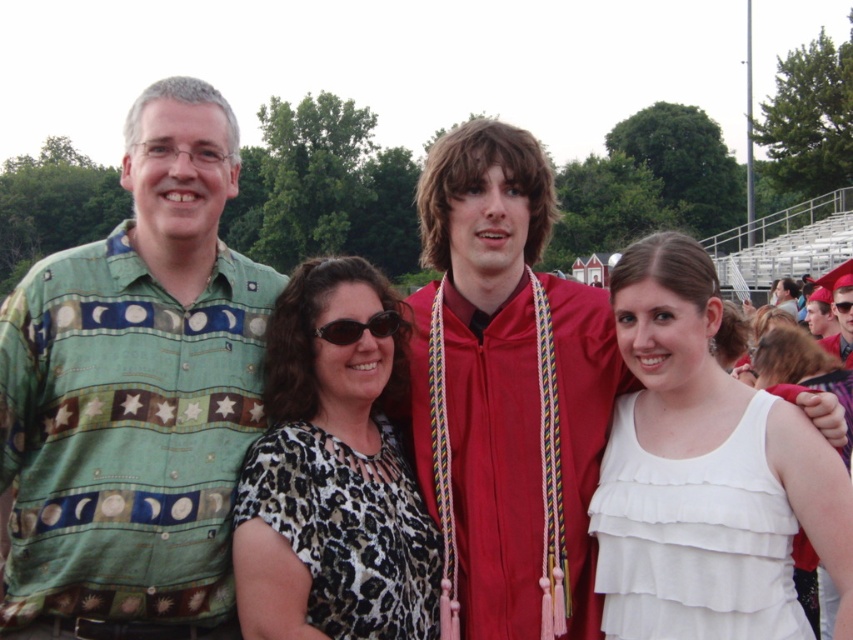
Question: Is leopard print blouse at center bigger than matte red graduation gown at center?

Choices:
 (A) yes
 (B) no

Answer: (B)

Question: Is leopard print blouse at center to the left of smooth red graduation gown at center from the viewer's perspective?

Choices:
 (A) no
 (B) yes

Answer: (B)

Question: Which is farther from the white ruffled dress at center?

Choices:
 (A) green textured shirt at left
 (B) matte red graduation gown at center
 (C) leopard print blouse at center

Answer: (B)

Question: Based on their relative distances, which object is farther from the leopard print blouse at center?

Choices:
 (A) white layered dress at center
 (B) red satin graduation gown at center

Answer: (A)

Question: Which of the following is the closest to the observer?

Choices:
 (A) matte red graduation gown at center
 (B) maroon satin robe at center
 (C) smooth red graduation gown at center

Answer: (B)

Question: From the image, what is the correct spatial relationship of leopard print blouse at center in relation to matte red graduation gown at center?

Choices:
 (A) right
 (B) left

Answer: (B)